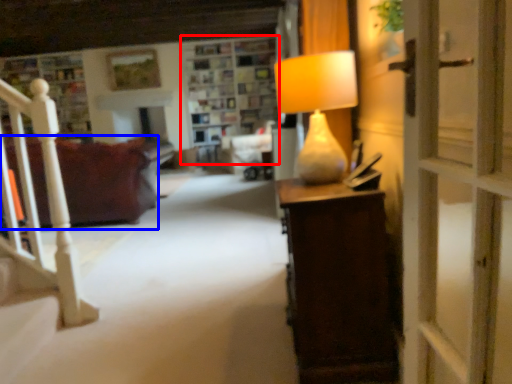
Question: Which object appears closest to the camera in this image, shelf (highlighted by a red box) or studio couch (highlighted by a blue box)?

Choices:
 (A) shelf
 (B) studio couch

Answer: (B)